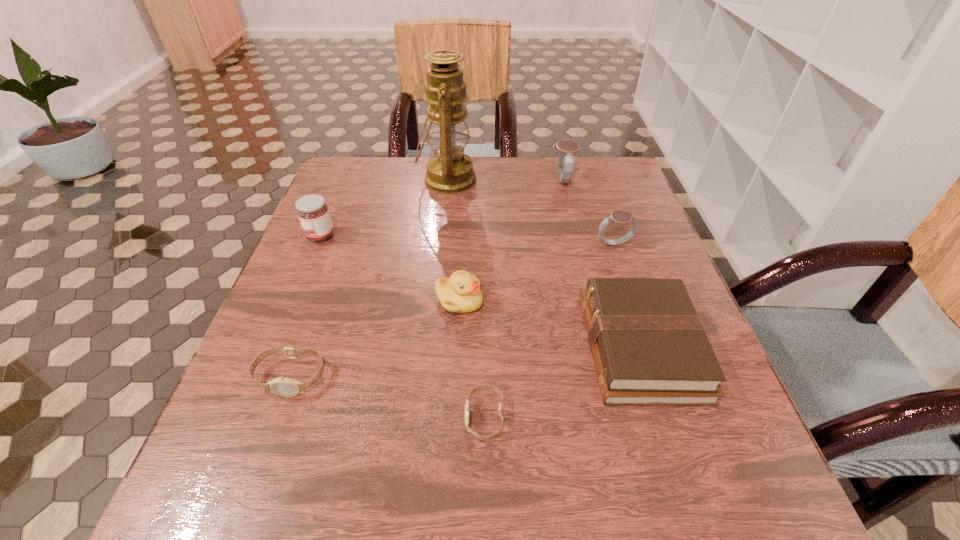
Where is `the shortest object`? the shortest object is located at coordinates (492, 388).

Find the location of `the second watch from left to right`. the second watch from left to right is located at coordinates (492, 388).

The width and height of the screenshot is (960, 540). In order to click on free location located on the right of the oil lamp in this screenshot , I will do `click(534, 180)`.

Where is `free space located 0.060m on the left of the farthest watch`? free space located 0.060m on the left of the farthest watch is located at coordinates (529, 180).

Find the location of a particular element. Image resolution: width=960 pixels, height=540 pixels. free space located on the right of the jam is located at coordinates (423, 236).

Where is `free space located on the back of the second farthest watch`? This screenshot has height=540, width=960. free space located on the back of the second farthest watch is located at coordinates (599, 200).

At what (x,y) coordinates should I click in order to perform the action: click on vacant region located on the front-facing side of the duckling. Please return your answer as a coordinate pair (x, y). This screenshot has width=960, height=540. Looking at the image, I should click on (671, 301).

You are a GUI agent. You are given a task and a screenshot of the screen. Output one action in this format:
    pyautogui.click(x=<x>, y=<y>)
    Task: Click on the vacant space located on the spine side of the Bible
    
    Given the screenshot: What is the action you would take?
    click(x=446, y=347)

Locate an element on the screen. The width and height of the screenshot is (960, 540). free spot located on the spine side of the Bible is located at coordinates (371, 347).

Where is `blank area located on the spine side of the Bible`? The height and width of the screenshot is (540, 960). blank area located on the spine side of the Bible is located at coordinates (523, 347).